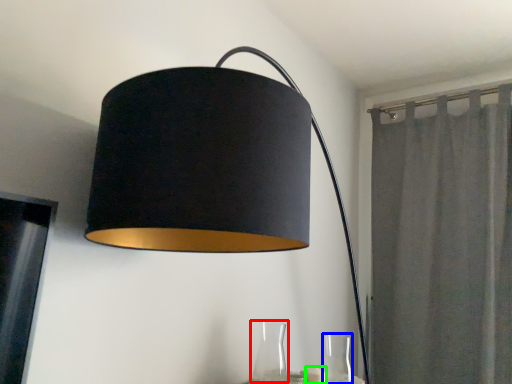
Question: Considering the real-world distances, which object is farthest from glass vase (highlighted by a red box)? glass vase (highlighted by a blue box) or candle (highlighted by a green box)?

Choices:
 (A) glass vase
 (B) candle

Answer: (A)